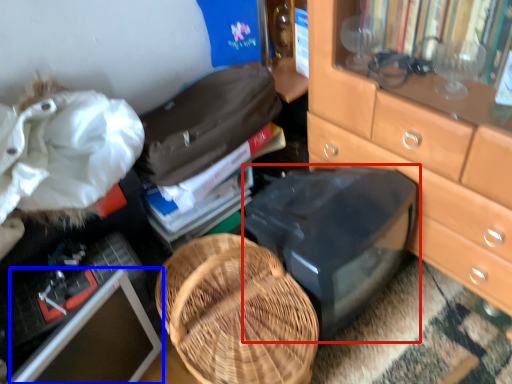
Question: Which object appears farthest to the camera in this image, desktop (highlighted by a red box) or computer monitor (highlighted by a blue box)?

Choices:
 (A) desktop
 (B) computer monitor

Answer: (A)